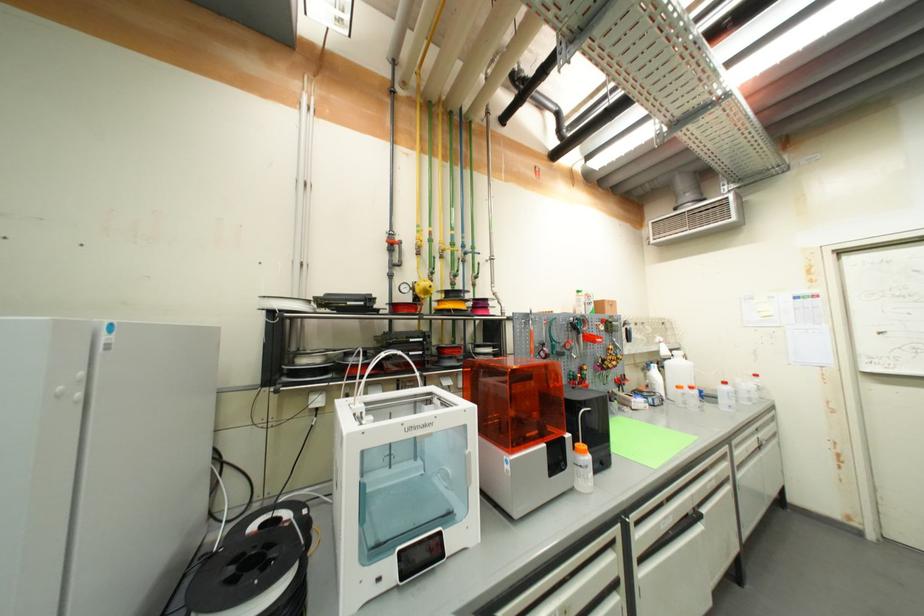
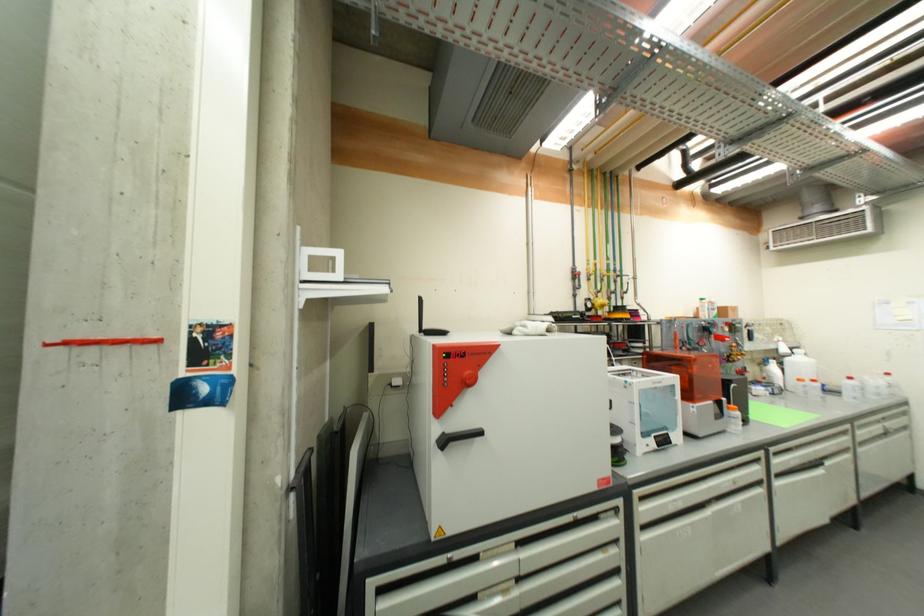
Find the pixel in the second image that matches (589,454) in the first image.

(739, 411)